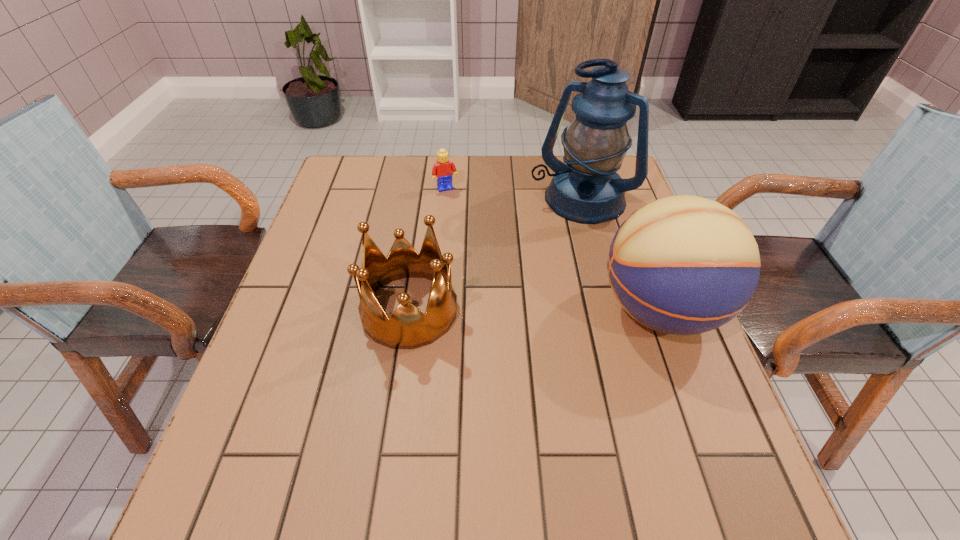
The image size is (960, 540). In order to click on free point located on the face of the lantern in this screenshot , I will do `click(545, 240)`.

This screenshot has width=960, height=540. Find the location of `free region located on the front-facing side of the shortest object`. free region located on the front-facing side of the shortest object is located at coordinates (497, 290).

The height and width of the screenshot is (540, 960). I want to click on vacant space located on the front-facing side of the shortest object, so pos(468,231).

Find the location of a particular element. This screenshot has height=540, width=960. vacant space situated on the front-facing side of the shortest object is located at coordinates (491, 275).

Locate an element on the screen. Image resolution: width=960 pixels, height=540 pixels. lantern that is positioned at the far edge is located at coordinates (587, 190).

I want to click on Lego that is at the far edge, so click(x=443, y=169).

The image size is (960, 540). I want to click on basketball present at the right edge, so click(x=684, y=265).

Locate an element on the screen. The height and width of the screenshot is (540, 960). lantern present at the right edge is located at coordinates (587, 190).

The image size is (960, 540). I want to click on object that is positioned at the far right corner, so click(x=587, y=190).

You are a GUI agent. You are given a task and a screenshot of the screen. Output one action in this format:
    pyautogui.click(x=<x>, y=<y>)
    Task: Click on the free location at the far edge of the desktop
    The width and height of the screenshot is (960, 540).
    Given the screenshot: What is the action you would take?
    pyautogui.click(x=433, y=155)